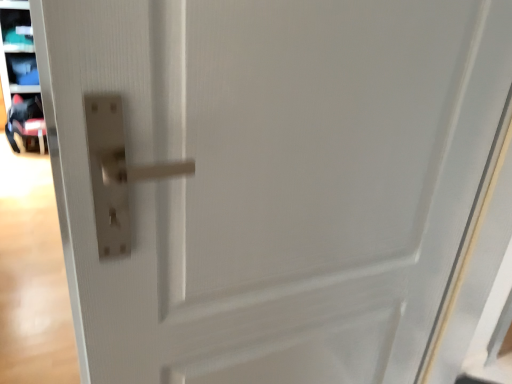
Question: Is black fabric baby carriage at left taller or shorter than matte plastic shelf at upper left?

Choices:
 (A) short
 (B) tall

Answer: (A)

Question: In terms of width, does black fabric baby carriage at left look wider or thinner when compared to matte plastic shelf at upper left?

Choices:
 (A) wide
 (B) thin

Answer: (A)

Question: Considering the positions of point (x=11, y=114) and point (x=9, y=54), is point (x=11, y=114) closer or farther from the camera than point (x=9, y=54)?

Choices:
 (A) farther
 (B) closer

Answer: (B)

Question: From their relative heights in the image, would you say matte plastic shelf at upper left is taller or shorter than black fabric baby carriage at left?

Choices:
 (A) short
 (B) tall

Answer: (B)

Question: From a real-world perspective, is matte plastic shelf at upper left physically located above or below black fabric baby carriage at left?

Choices:
 (A) above
 (B) below

Answer: (A)

Question: Looking at their shapes, would you say matte plastic shelf at upper left is wider or thinner than black fabric baby carriage at left?

Choices:
 (A) wide
 (B) thin

Answer: (B)

Question: Considering their positions, is matte plastic shelf at upper left located in front of or behind black fabric baby carriage at left?

Choices:
 (A) front
 (B) behind

Answer: (B)